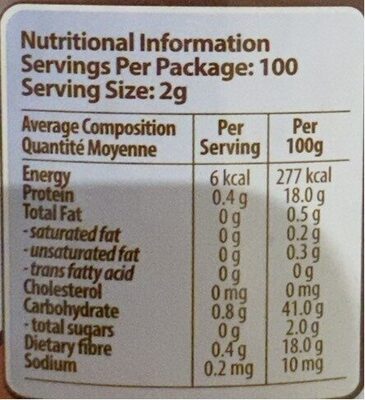
This screenshot has height=400, width=365. Find the location of `shadow on picture`. shadow on picture is located at coordinates (170, 236).